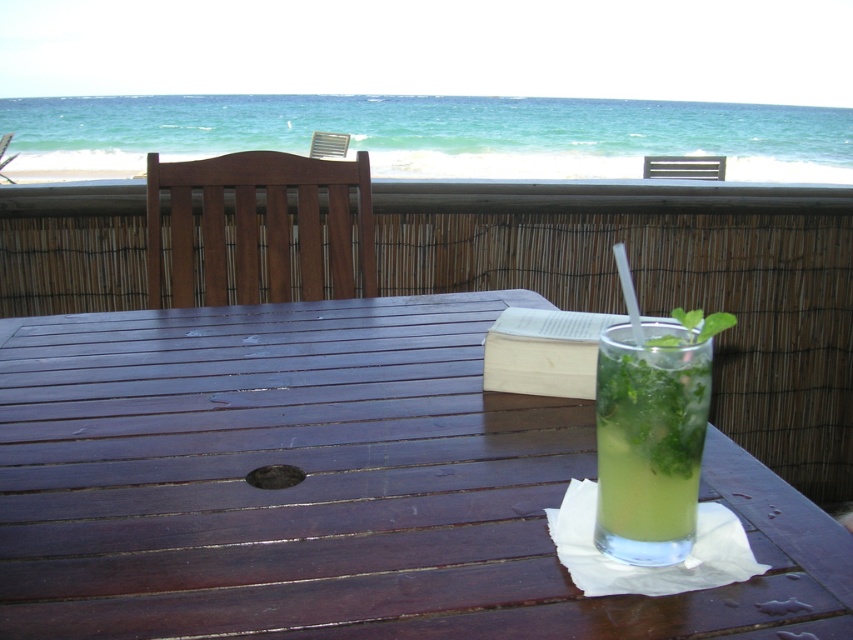
You are a guest at this oceanview balcony and want to place a small plate on the wooden table at center. However, there is already a glass with green leafy liquid at center on it. Where should you place the plate to ensure it stays on the table?

The wooden table at center is to the left of green leafy liquid at center, so placing the plate to the right of the green leafy liquid at center will keep it on the table.

You are standing at the edge of the balcony and want to place a small potted plant on the wooden table at center. Based on the coordinates provided, can you confirm if the wooden table at center is located at point (335,486)?

Yes, the wooden table at center is located at point (335,486) as stated in the objects description.

You are standing on the balcony and want to place a small potted plant between the two points labeled point (x=485, y=564) and point (x=692, y=483). Which point should the plant be closer to in order to be closer to the railing?

The plant should be placed closer to point (x=692, y=483) because it is closer to the railing than point (x=485, y=564).